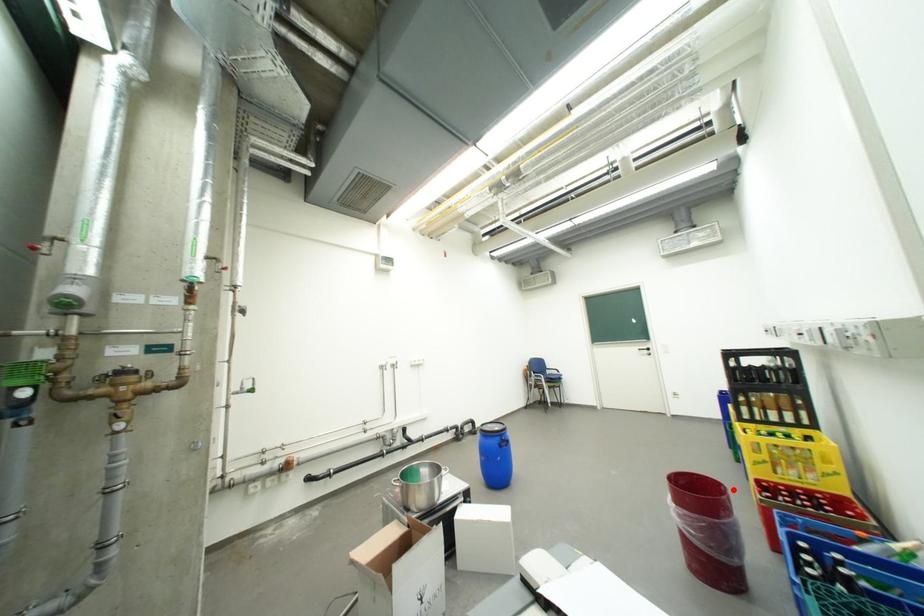
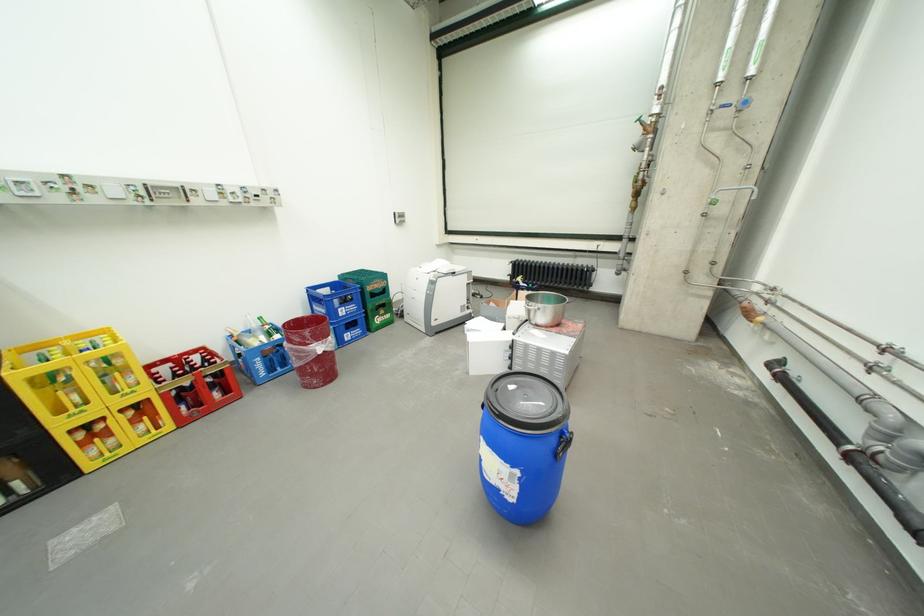
The point at the highlighted location is marked in the first image. Where is the corresponding point in the second image?

(297, 328)